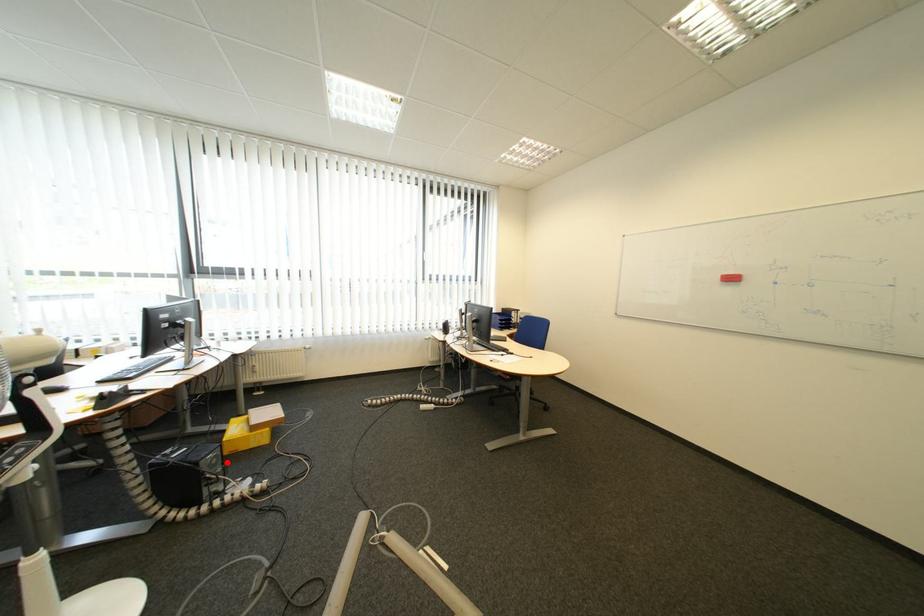
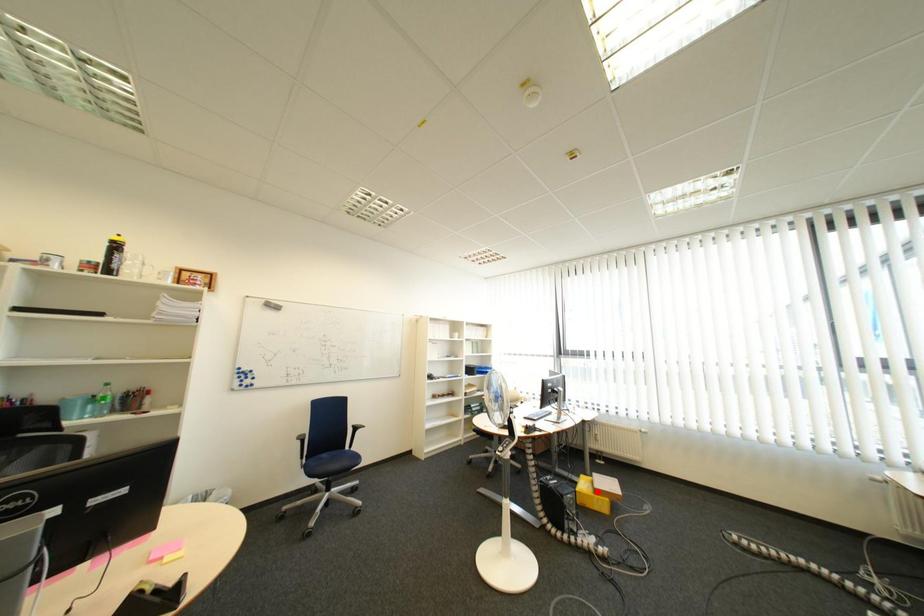
I am providing you with two images of the same scene from different viewpoints. A red point is marked on the first image and another point is marked on the second image. Is the red point in image1 aligned with the point shown in image2?

No